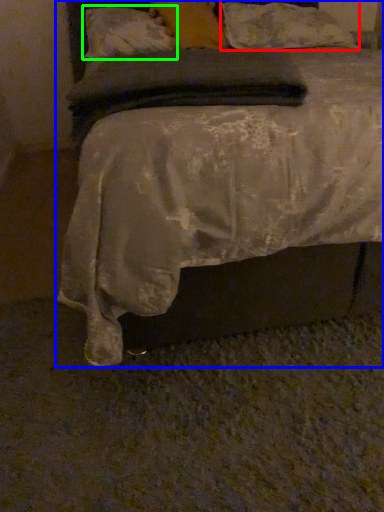
Question: Considering the real-world distances, which object is closest to pillow (highlighted by a red box)? bed (highlighted by a blue box) or pillow (highlighted by a green box).

Choices:
 (A) bed
 (B) pillow

Answer: (B)